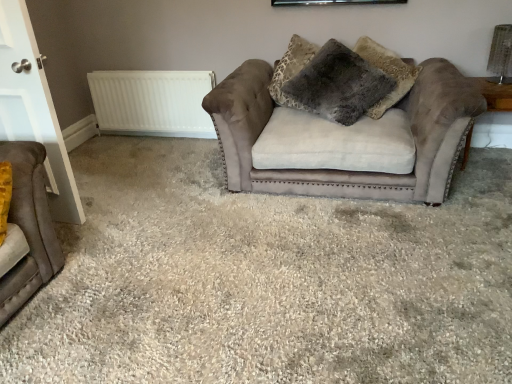
The image size is (512, 384). In order to click on blank space situated above white matte radiator at upper left (from a real-world perspective) in this screenshot , I will do `click(151, 74)`.